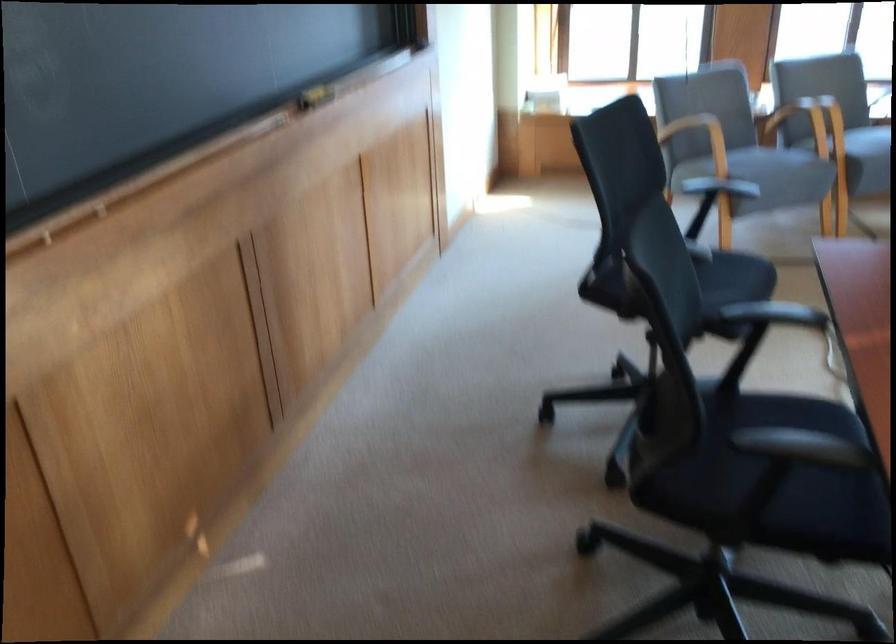
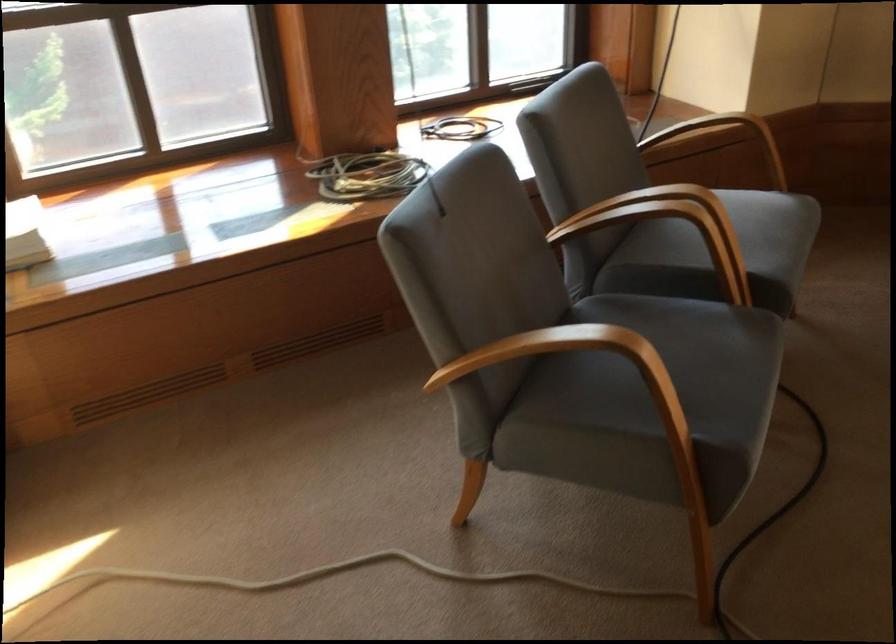
Find the pixel in the second image that matches point (737, 147) in the first image.

(650, 398)